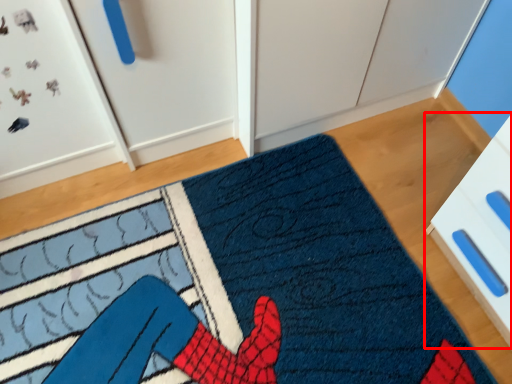
Question: From the image's perspective, what is the correct spatial positioning of drawer (annotated by the red box) in reference to doormat?

Choices:
 (A) above
 (B) below

Answer: (A)